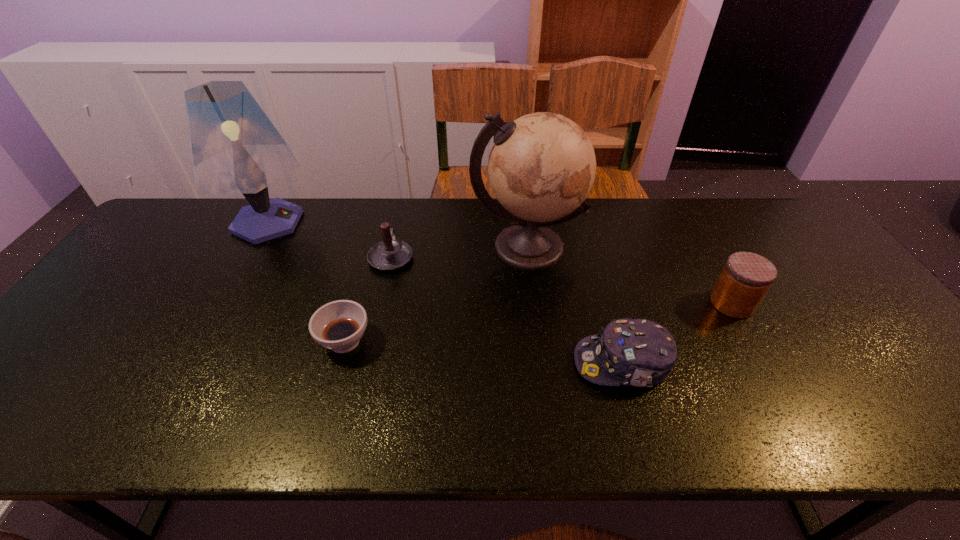
Locate an element on the screen. The height and width of the screenshot is (540, 960). blank region between the headwear and the lampshade is located at coordinates (444, 293).

At what (x,y) coordinates should I click in order to perform the action: click on vacant region between the rightmost object and the candle. Please return your answer as a coordinate pair (x, y). The image size is (960, 540). Looking at the image, I should click on (562, 280).

Find the location of a particular element. The image size is (960, 540). vacant point located between the globe and the second shortest object is located at coordinates (574, 305).

Where is `the third closest object relative to the soup bowl`? This screenshot has height=540, width=960. the third closest object relative to the soup bowl is located at coordinates (234, 147).

This screenshot has width=960, height=540. I want to click on object that ranks as the second closest to the lampshade, so click(339, 325).

Where is `free point that satisfies the following two spatial constraints: 1. on the base of the soup bowl; 2. on the left side of the lampshade`? free point that satisfies the following two spatial constraints: 1. on the base of the soup bowl; 2. on the left side of the lampshade is located at coordinates (200, 341).

The height and width of the screenshot is (540, 960). Identify the location of vacant point that satisfies the following two spatial constraints: 1. on the side of the candle with the handle loop; 2. on the base of the leftmost object. (398, 222).

The image size is (960, 540). I want to click on vacant area in the image that satisfies the following two spatial constraints: 1. on the base of the leftmost object; 2. on the back side of the third nearest object, so click(x=221, y=303).

Identify the location of free space that satisfies the following two spatial constraints: 1. on the front side of the third nearest object; 2. on the front-facing side of the headwear. Image resolution: width=960 pixels, height=540 pixels. (765, 363).